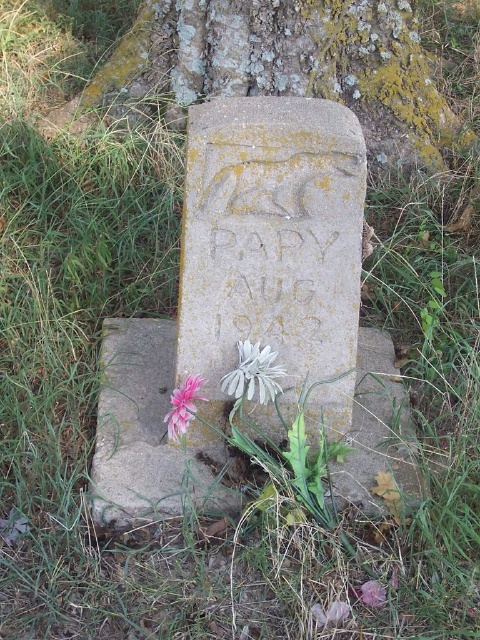
You are standing in front of the grave marker and want to place a new offering. If you want to place a new flower closer to the grave marker than the existing white matte flower at center, where should you place it relative to the pink matte flower at lower left?

To place a new flower closer to the grave marker than the white matte flower at center, you should position it between the white matte flower at center and the pink matte flower at lower left, but closer to the grave marker. However, since the white matte flower at center is already closer to the viewer than the pink matte flower at lower left, placing it closer would require moving it behind the white matte flower at center towards the grave marker, but this might not be possible if the white flower is in

You are standing at the grave marker and want to place a new flower offering. There are two existing points marked as point 1 at coordinates (194, 490) and point 2 at coordinates (238, 342). According to the image, which point is closer to the front of the grave marker?

Point 1 at coordinates (194, 490) is closer to the front of the grave marker because it is in front of point 2 at coordinates (238, 342).

You are standing in front of the grave marker and want to place a new offering. If you want to place it above the stone at center, where should you put it relative to the white matte flower at center?

The stone at center is below the white matte flower at center, so placing an offering above the stone at center would mean placing it below the white matte flower at center.